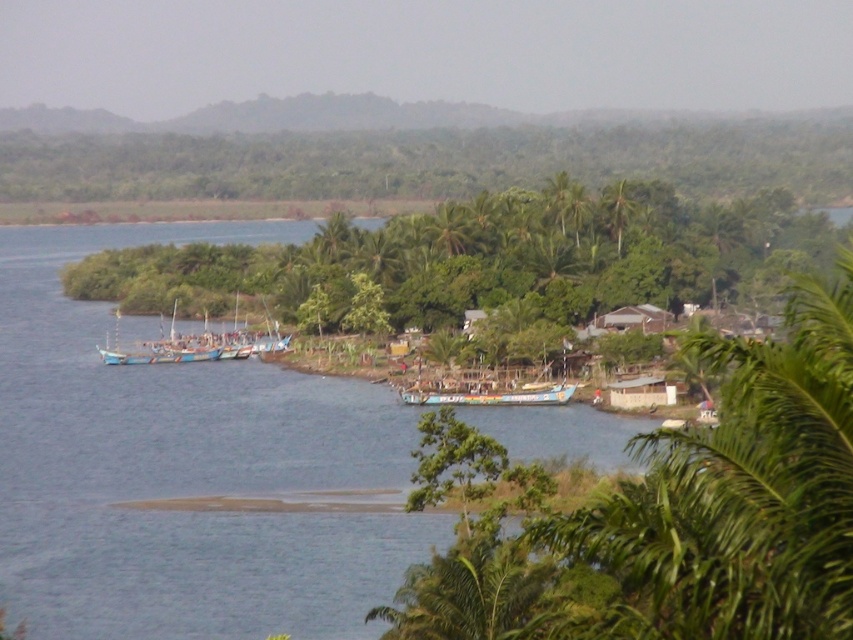
Question: Among these objects, which one is farthest from the camera?

Choices:
 (A) blue wooden boats at center
 (B) green leafy palm tree at center

Answer: (B)

Question: Which object appears farthest from the camera in this image?

Choices:
 (A) blue painted wooden boat at center
 (B) green leafy palm tree at center
 (C) blue wooden boats at center

Answer: (B)

Question: Which point is farther to the camera?

Choices:
 (A) green leafy palm tree at center
 (B) blue wooden boats at center

Answer: (A)

Question: Can you confirm if blue wooden boats at center is thinner than green leafy palm tree at center?

Choices:
 (A) no
 (B) yes

Answer: (A)

Question: Where is blue wooden boats at center located in relation to blue painted wooden boat at center in the image?

Choices:
 (A) left
 (B) right

Answer: (A)

Question: Does blue wooden boats at center appear on the left side of blue painted wooden boat at center?

Choices:
 (A) yes
 (B) no

Answer: (A)